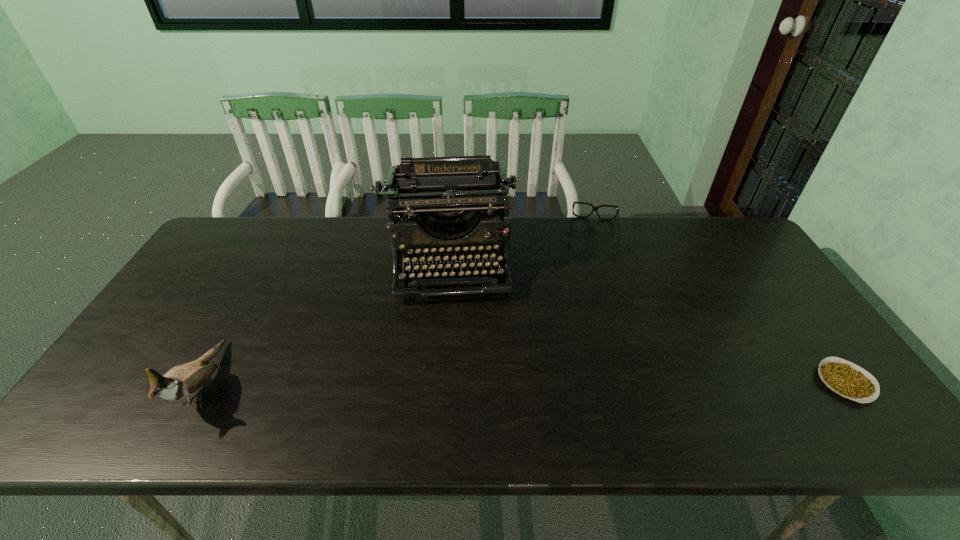
Where is `bird`? Image resolution: width=960 pixels, height=540 pixels. bird is located at coordinates (182, 381).

Where is `the second tallest object`? the second tallest object is located at coordinates (182, 381).

Locate an element on the screen. the rightmost object is located at coordinates (847, 379).

Find the location of a particular element. The image size is (960, 540). legume is located at coordinates (847, 379).

Locate an element on the screen. This screenshot has width=960, height=540. the second object from left to right is located at coordinates (448, 193).

The image size is (960, 540). I want to click on the tallest object, so click(x=448, y=193).

Where is `the second shortest object`? The height and width of the screenshot is (540, 960). the second shortest object is located at coordinates (595, 208).

You are a GUI agent. You are given a task and a screenshot of the screen. Output one action in this format:
    pyautogui.click(x=<x>, y=<y>)
    Task: Click on the second object from right to left
    The width and height of the screenshot is (960, 540).
    Given the screenshot: What is the action you would take?
    pyautogui.click(x=595, y=208)

The height and width of the screenshot is (540, 960). I want to click on vacant space located on the back of the shortest object, so click(x=790, y=305).

Where is `free location located on the typing side of the third object from right to left`? Image resolution: width=960 pixels, height=540 pixels. free location located on the typing side of the third object from right to left is located at coordinates (453, 374).